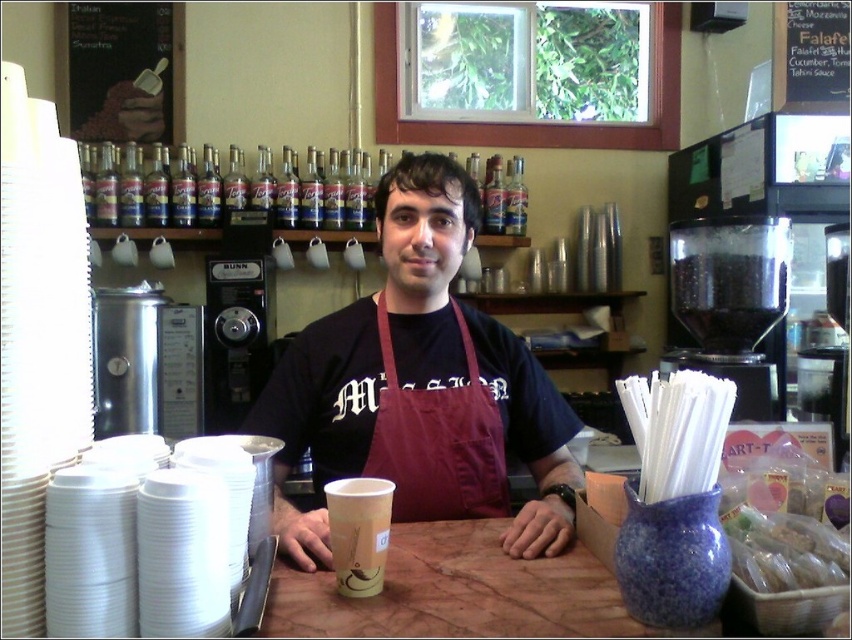
Does black plastic coffee machine at right have a larger size compared to translucent plastic bag at lower right?

Correct, black plastic coffee machine at right is larger in size than translucent plastic bag at lower right.

Who is more forward, (764, 182) or (809, 554)?

Point (809, 554) is in front.

Locate an element on the screen. The height and width of the screenshot is (640, 852). black plastic coffee machine at right is located at coordinates (772, 202).

In the scene shown: Which is above, maroon apron at center or black plastic coffee machine at right?

black plastic coffee machine at right is above.

Who is positioned more to the left, maroon apron at center or black plastic coffee machine at right?

Positioned to the left is maroon apron at center.

Between point (534, 449) and point (691, 156), which one is positioned behind?

Point (691, 156)

Find the location of a particular element. Image resolution: width=852 pixels, height=640 pixels. maroon apron at center is located at coordinates 419,387.

Is the position of brown marble table at center less distant than that of black plastic coffee machine at right?

That is True.

Who is more forward, (401,586) or (795,246)?

Positioned in front is point (401,586).

The image size is (852, 640). I want to click on brown marble table at center, so click(459, 593).